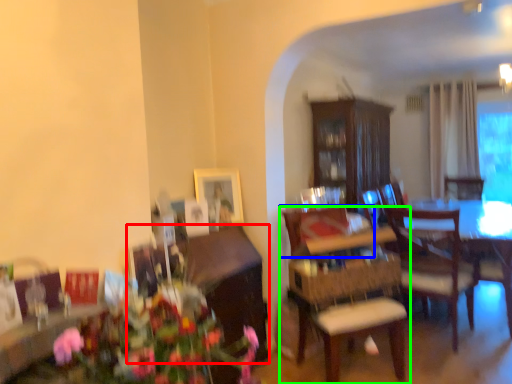
Question: Which is nearer to the cabinetry (highlighted by a red box)? chair (highlighted by a blue box) or chair (highlighted by a green box).

Choices:
 (A) chair
 (B) chair

Answer: (A)